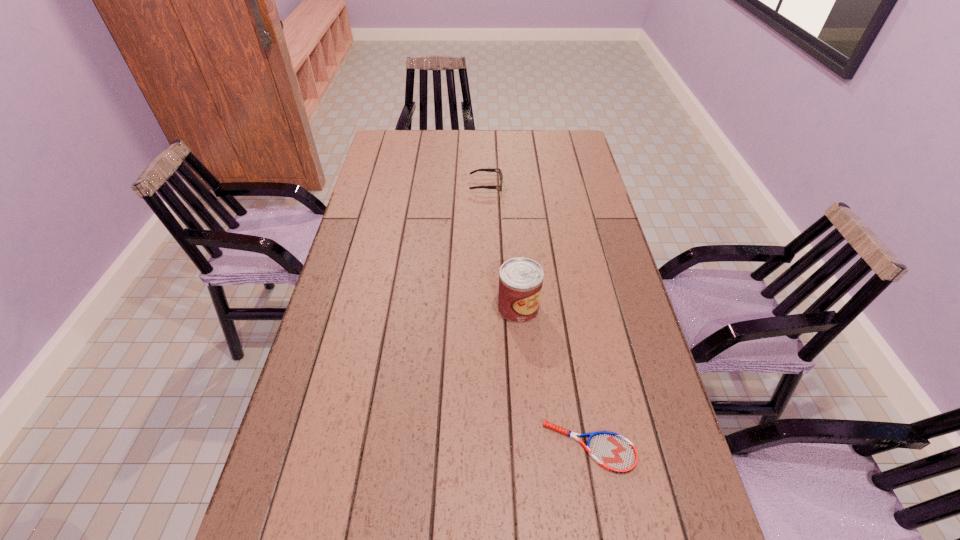
What are the coordinates of `can` in the screenshot? It's located at (520, 279).

Identify the location of the second nearest object. (520, 279).

The image size is (960, 540). I want to click on sunglasses, so click(x=485, y=169).

Locate an element on the screen. The width and height of the screenshot is (960, 540). the second tallest object is located at coordinates (485, 169).

I want to click on tennis racket, so click(612, 451).

The width and height of the screenshot is (960, 540). What are the coordinates of `the shortest object` in the screenshot? It's located at (612, 451).

You are a GUI agent. You are given a task and a screenshot of the screen. Output one action in this format:
    pyautogui.click(x=<x>, y=<y>)
    Task: Click on the vacant space positioned on the right of the can
    The height and width of the screenshot is (540, 960).
    Given the screenshot: What is the action you would take?
    pyautogui.click(x=627, y=308)

Where is `vacant space situated 0.060m on the front-facing side of the farthest object`? The height and width of the screenshot is (540, 960). vacant space situated 0.060m on the front-facing side of the farthest object is located at coordinates (453, 185).

Identify the location of blank space located 0.220m on the front-facing side of the farthest object. This screenshot has width=960, height=540. (409, 185).

The height and width of the screenshot is (540, 960). In order to click on vacant space positioned on the front-facing side of the farthest object in this screenshot , I will do `click(456, 185)`.